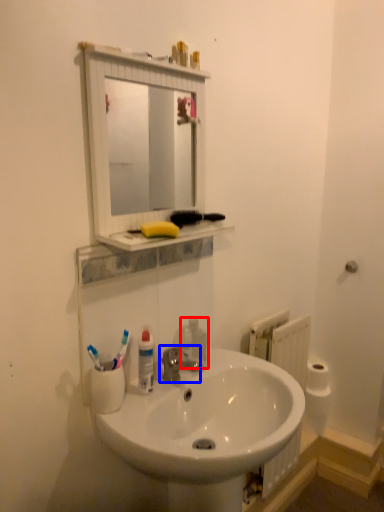
Question: Among these objects, which one is nearest to the camera, soap dispenser (highlighted by a red box) or tap (highlighted by a blue box)?

Choices:
 (A) soap dispenser
 (B) tap

Answer: (B)